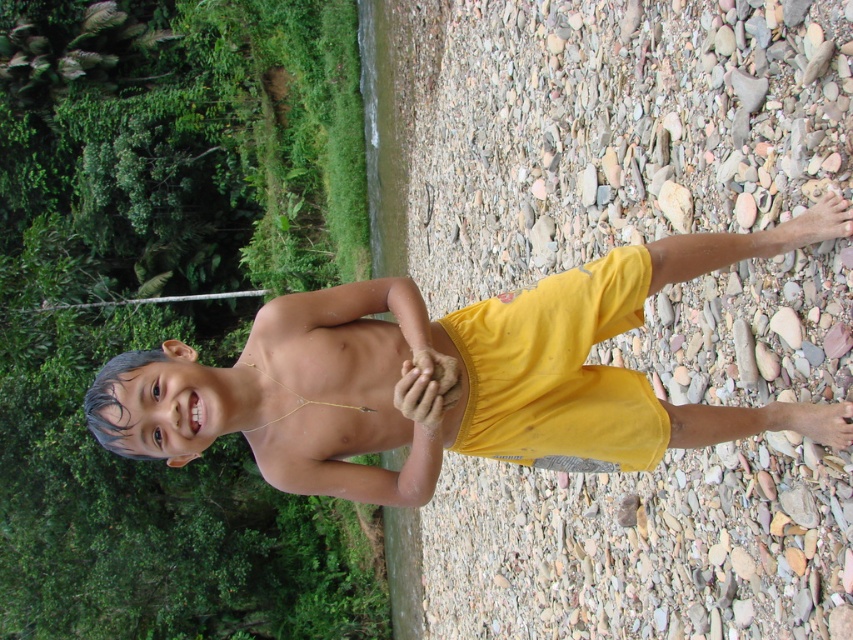
What do you see at coordinates (146, 300) in the screenshot? The image size is (853, 640). I see `green leafy branch at upper left` at bounding box center [146, 300].

From the picture: Which of these two, green leafy branch at upper left or gold/yellow string at center, stands shorter?

gold/yellow string at center is shorter.

Describe the element at coordinates (146, 300) in the screenshot. Image resolution: width=853 pixels, height=640 pixels. I see `green leafy branch at upper left` at that location.

Identify the location of green leafy branch at upper left. The height and width of the screenshot is (640, 853). (146, 300).

Is yellow cotton shorts at center positioned at the back of gold/yellow string at center?

That is False.

Which of these two, yellow cotton shorts at center or gold/yellow string at center, stands taller?

yellow cotton shorts at center

Describe the element at coordinates (497, 374) in the screenshot. I see `yellow cotton shorts at center` at that location.

Identify the location of yellow cotton shorts at center. The width and height of the screenshot is (853, 640). (497, 374).

Is yellow cotton shorts at center positioned in front of green leafy branch at upper left?

Yes, yellow cotton shorts at center is in front of green leafy branch at upper left.

Locate an element on the screen. This screenshot has width=853, height=640. yellow cotton shorts at center is located at coordinates (497, 374).